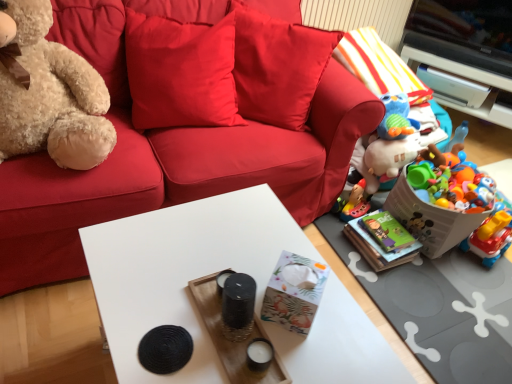
At what (x,y) coordinates should I click in order to perform the action: click on vacant area located to the right-hand side of floral paper tissue box at center, acting as the 1th box starting from the left. Please return your answer as a coordinate pair (x, y). The height and width of the screenshot is (384, 512). Looking at the image, I should click on (355, 336).